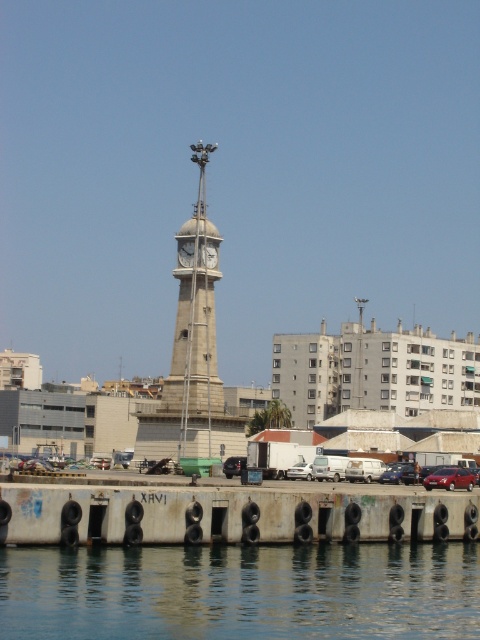
You are standing on the concrete pier in the waterfront scene. You see the stone clock tower at center marked by point (192, 356). If you face directly towards the tower, which direction should you walk to reach it?

The stone clock tower at center is located at point (192, 356), so you should walk straight ahead towards the tower since it is directly in front of you.

You are a tourist standing on the pier and want to take a photo of the white glossy clock at center without the white matte van at center blocking it. Is the van currently blocking your view of the clock?

The white matte van at center is in front of the white glossy clock at center, so yes, the van is blocking the view of the clock.

You are a tourist standing at the waterfront and want to take a photo of the stone clock tower at center without the shiny red sedan at lower right appearing in the frame. Is it possible to position yourself in such a way that the sedan is out of view while still capturing the tower?

The stone clock tower at center is located above the shiny red sedan at lower right, so by positioning yourself at a higher elevation or angling your camera upward, you can frame the shot to exclude the sedan while still including the tower in the photograph.